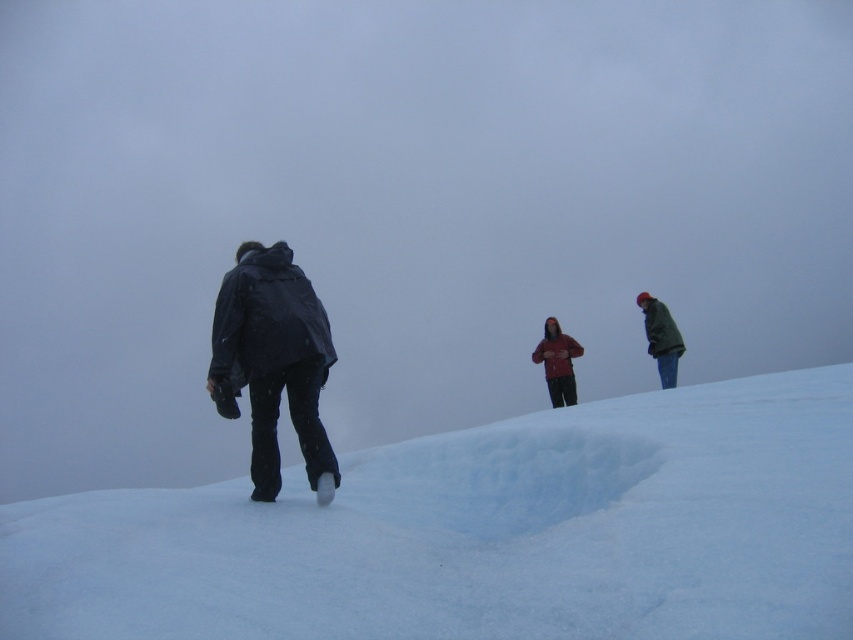
Question: Estimate the real-world distances between objects in this image. Which object is closer to the white fluffy snow at center?

Choices:
 (A) matte black jacket at left
 (B) matte red jacket at center
 (C) green matte jacket at upper right

Answer: (A)

Question: Is white fluffy snow at center in front of matte black jacket at left?

Choices:
 (A) no
 (B) yes

Answer: (B)

Question: Among these objects, which one is nearest to the camera?

Choices:
 (A) white fluffy snow at center
 (B) matte black jacket at left
 (C) matte red jacket at center
 (D) green matte jacket at upper right

Answer: (A)

Question: Can you confirm if matte black jacket at left is bigger than matte red jacket at center?

Choices:
 (A) no
 (B) yes

Answer: (A)

Question: Can you confirm if matte red jacket at center is smaller than green matte jacket at upper right?

Choices:
 (A) yes
 (B) no

Answer: (B)

Question: Among these objects, which one is farthest from the camera?

Choices:
 (A) matte black jacket at left
 (B) matte red jacket at center
 (C) green matte jacket at upper right
 (D) white fluffy snow at center

Answer: (B)